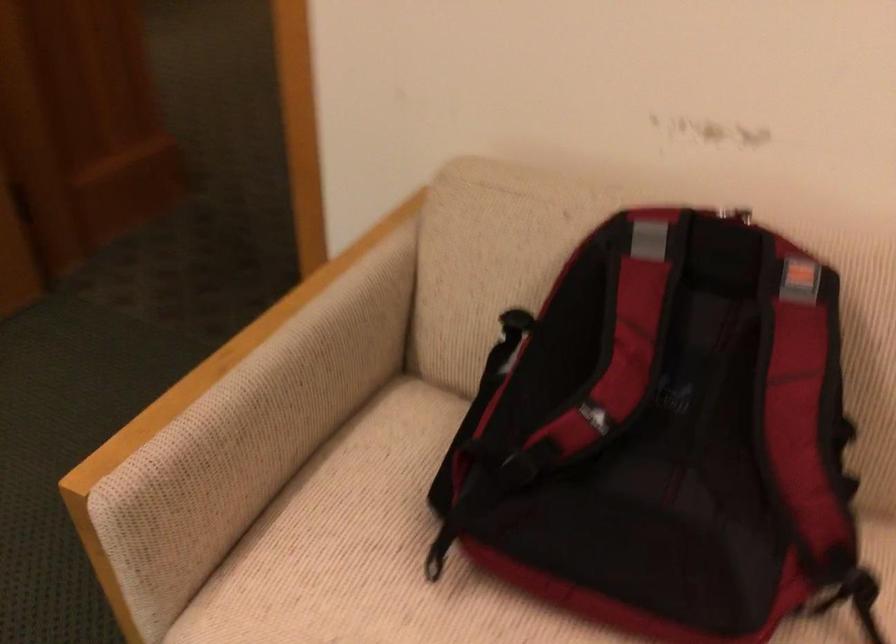
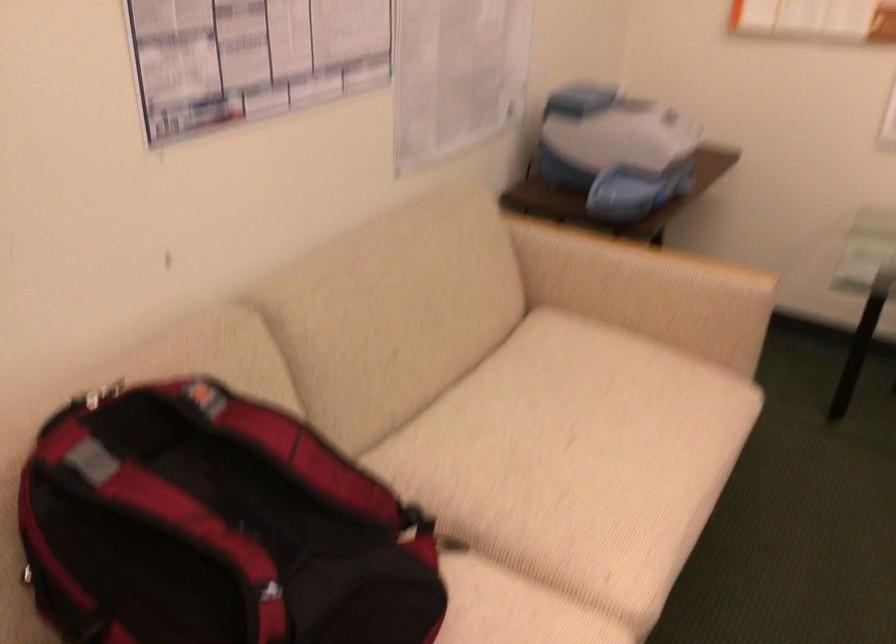
The images are taken continuously from a first-person perspective. In which direction is your viewpoint rotating?

The rotation direction of the camera is right-down.